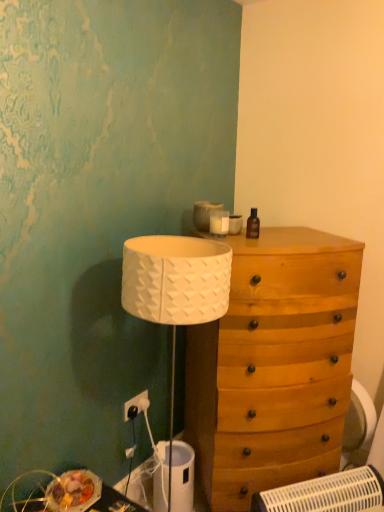
Where is `wooden drawer at center`? This screenshot has width=384, height=512. wooden drawer at center is located at coordinates (265, 480).

What is the approximate width of wooden chest of drawers at right?

wooden chest of drawers at right is 21.96 inches wide.

Find the location of a particular element. This screenshot has height=512, width=384. brown glass bottle at upper right is located at coordinates (253, 225).

Is white plastic swivel chair at lower right inside or outside of white plastic electric outlet at lower left?

white plastic swivel chair at lower right cannot be found inside white plastic electric outlet at lower left.

Between white plastic swivel chair at lower right and white plastic electric outlet at lower left, which one has larger width?

white plastic swivel chair at lower right is wider.

Is white plastic swivel chair at lower right in front of or behind white plastic electric outlet at lower left in the image?

white plastic swivel chair at lower right is positioned farther from the viewer than white plastic electric outlet at lower left.

From the image's perspective, which object appears higher, white plastic swivel chair at lower right or white plastic electric outlet at lower left?

white plastic electric outlet at lower left.

Is wooden chest of drawers at right not near wooden drawer at center?

No, wooden chest of drawers at right is in close proximity to wooden drawer at center.

Can you tell me how much wooden chest of drawers at right and wooden drawer at center differ in facing direction?

The angular difference between wooden chest of drawers at right and wooden drawer at center is 2.87 degrees.

Between point (234, 274) and point (217, 490), which one is positioned in front?

Point (234, 274)

Does wooden chest of drawers at right have a smaller size compared to wooden drawer at center?

Incorrect, wooden chest of drawers at right is not smaller in size than wooden drawer at center.

I want to click on the chest of drawers that appears below the brown glass bottle at upper right (from a real-world perspective), so click(x=274, y=366).

Which point is more distant from viewer, (254,238) or (244,436)?

Point (244,436)

Can you confirm if brown glass bottle at upper right is taller than wooden chest of drawers at right?

Incorrect, the height of brown glass bottle at upper right is not larger of that of wooden chest of drawers at right.

Considering the positions of objects brown glass bottle at upper right and wooden chest of drawers at right in the image provided, who is in front, brown glass bottle at upper right or wooden chest of drawers at right?

wooden chest of drawers at right is closer to the camera.

Considering the relative sizes of white plastic swivel chair at lower right and wooden drawer at center in the image provided, is white plastic swivel chair at lower right taller than wooden drawer at center?

Indeed, white plastic swivel chair at lower right has a greater height compared to wooden drawer at center.

From a real-world perspective, is white plastic swivel chair at lower right physically located above or below wooden drawer at center?

In terms of real-world spatial position, white plastic swivel chair at lower right is above wooden drawer at center.

Looking at this image, between white plastic swivel chair at lower right and wooden drawer at center, which one has larger size?

With larger size is wooden drawer at center.

Visually, is white plastic swivel chair at lower right positioned to the left or to the right of wooden drawer at center?

Clearly, white plastic swivel chair at lower right is on the right of wooden drawer at center in the image.

Which object is closer to the camera taking this photo, wooden chest of drawers at right or brown glass bottle at upper right?

wooden chest of drawers at right.

The image size is (384, 512). Find the location of `bottle located behind the wooden chest of drawers at right`. bottle located behind the wooden chest of drawers at right is located at coordinates (253, 225).

Could you tell me if wooden chest of drawers at right is turned towards brown glass bottle at upper right?

No.

How much distance is there between wooden chest of drawers at right and brown glass bottle at upper right?

The distance of wooden chest of drawers at right from brown glass bottle at upper right is 23.84 inches.

Which is more to the left, brown glass bottle at upper right or wooden drawer at center?

From the viewer's perspective, brown glass bottle at upper right appears more on the left side.

Does brown glass bottle at upper right have a greater width compared to wooden drawer at center?

No, brown glass bottle at upper right is not wider than wooden drawer at center.

Could you tell me if brown glass bottle at upper right is facing wooden drawer at center?

No.

At what (x,y) coordinates should I click in order to perform the action: click on drawer below the brown glass bottle at upper right (from the image's perspective). Please return your answer as a coordinate pair (x, y). Image resolution: width=384 pixels, height=512 pixels. Looking at the image, I should click on (265, 480).

From the image's perspective, does white plastic swivel chair at lower right appear higher than wooden chest of drawers at right?

Incorrect, from the image's perspective, white plastic swivel chair at lower right is lower than wooden chest of drawers at right.

In terms of size, does white plastic swivel chair at lower right appear bigger or smaller than wooden chest of drawers at right?

white plastic swivel chair at lower right is smaller than wooden chest of drawers at right.

From a real-world perspective, does white plastic swivel chair at lower right stand above wooden chest of drawers at right?

No, from a real-world perspective, white plastic swivel chair at lower right is not over wooden chest of drawers at right

Find the location of a particular element. The width and height of the screenshot is (384, 512). swivel chair that appears on the right of white plastic electric outlet at lower left is located at coordinates (358, 423).

Find the location of `drawer in front of the wooden chest of drawers at right`. drawer in front of the wooden chest of drawers at right is located at coordinates (265, 480).

Which object lies nearer to the anchor point white plastic swivel chair at lower right, wooden drawer at center or wooden chest of drawers at right?

wooden drawer at center is closer to white plastic swivel chair at lower right.

Based on their spatial positions, is white plastic electric outlet at lower left or wooden drawer at center further from wooden chest of drawers at right?

white plastic electric outlet at lower left is further to wooden chest of drawers at right.

Consider the image. Estimate the real-world distances between objects in this image. Which object is further from wooden drawer at center, brown glass bottle at upper right or white plastic electric outlet at lower left?

brown glass bottle at upper right.

Looking at the image, which one is located closer to white plastic electric outlet at lower left, brown glass bottle at upper right or wooden chest of drawers at right?

Among the two, wooden chest of drawers at right is located nearer to white plastic electric outlet at lower left.

Based on their spatial positions, is wooden drawer at center or wooden chest of drawers at right further from brown glass bottle at upper right?

wooden drawer at center.

From the image, which object appears to be nearer to white plastic swivel chair at lower right, wooden drawer at center or white plastic electric outlet at lower left?

wooden drawer at center is positioned closer to the anchor white plastic swivel chair at lower right.

When comparing their distances from wooden chest of drawers at right, does white plastic swivel chair at lower right or wooden drawer at center seem closer?

wooden drawer at center lies closer to wooden chest of drawers at right than the other object.

Which object lies nearer to the anchor point white plastic swivel chair at lower right, wooden chest of drawers at right or white plastic electric outlet at lower left?

wooden chest of drawers at right.

Identify the location of chest of drawers between brown glass bottle at upper right and white plastic swivel chair at lower right in the up-down direction. This screenshot has height=512, width=384. (274, 366).

Locate an element on the screen. drawer between white plastic electric outlet at lower left and white plastic swivel chair at lower right is located at coordinates (265, 480).

In order to click on the chest of drawers between brown glass bottle at upper right and wooden drawer at center vertically in this screenshot , I will do pyautogui.click(x=274, y=366).

The width and height of the screenshot is (384, 512). In order to click on chest of drawers between wooden drawer at center and white plastic swivel chair at lower right in the front-back direction in this screenshot , I will do `click(274, 366)`.